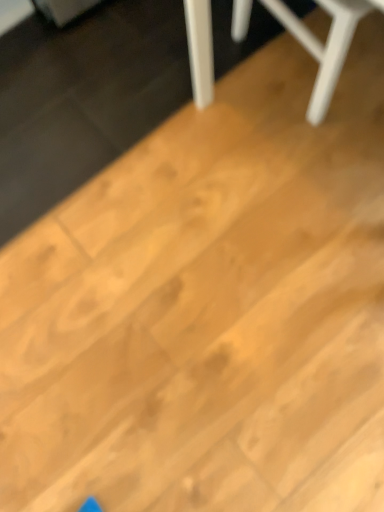
Locate an element on the screen. The height and width of the screenshot is (512, 384). free space to the left of white matte chair at upper right is located at coordinates 170,91.